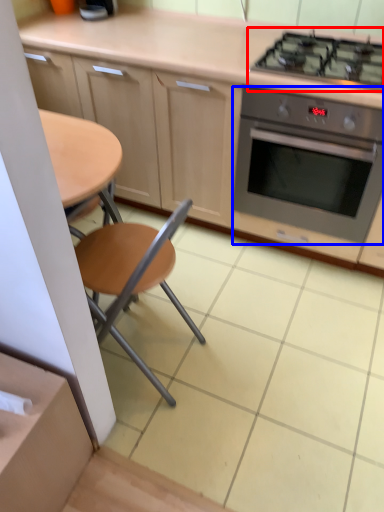
Question: Among these objects, which one is nearest to the camera, gas stove (highlighted by a red box) or kitchen appliance (highlighted by a blue box)?

Choices:
 (A) gas stove
 (B) kitchen appliance

Answer: (A)